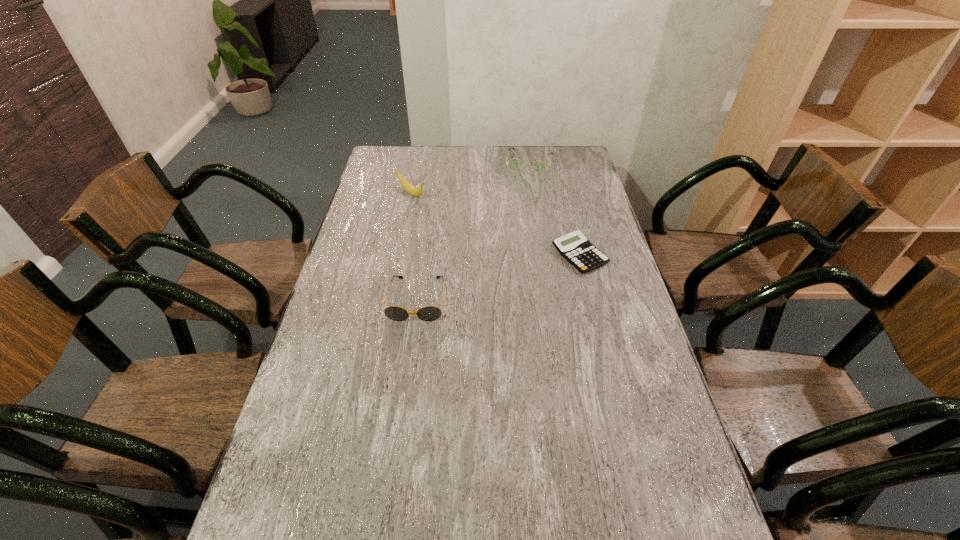
Identify the location of vacant space at the left edge of the desktop. This screenshot has height=540, width=960. (390, 181).

In the image, there is a desktop. Find the location of `vacant region at the right edge`. vacant region at the right edge is located at coordinates (601, 205).

Identify the location of free space at the far left corner of the desktop. The height and width of the screenshot is (540, 960). (400, 167).

The height and width of the screenshot is (540, 960). In the image, there is a desktop. Find the location of `vacant area at the far right corner`. vacant area at the far right corner is located at coordinates (570, 156).

This screenshot has width=960, height=540. Identify the location of vacant area between the farthest object and the banana. (470, 178).

I want to click on vacant point located between the nearest object and the farthest object, so click(x=473, y=231).

Locate an element on the screen. The image size is (960, 540). free space between the tallest object and the sunglasses is located at coordinates (415, 247).

This screenshot has width=960, height=540. Identify the location of empty location between the banana and the second nearest object. (495, 225).

What are the coordinates of `free point between the nearest object and the calculator` in the screenshot? It's located at (498, 278).

In order to click on free space between the third nearest object and the sunglasses in this screenshot , I will do `click(415, 247)`.